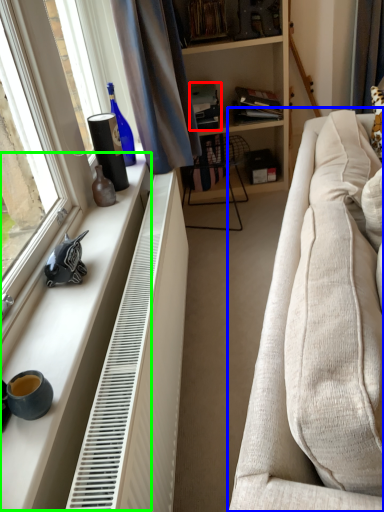
Question: Considering the real-world distances, which object is farthest from book (highlighted by a red box)? studio couch (highlighted by a blue box) or window sill (highlighted by a green box)?

Choices:
 (A) studio couch
 (B) window sill

Answer: (B)